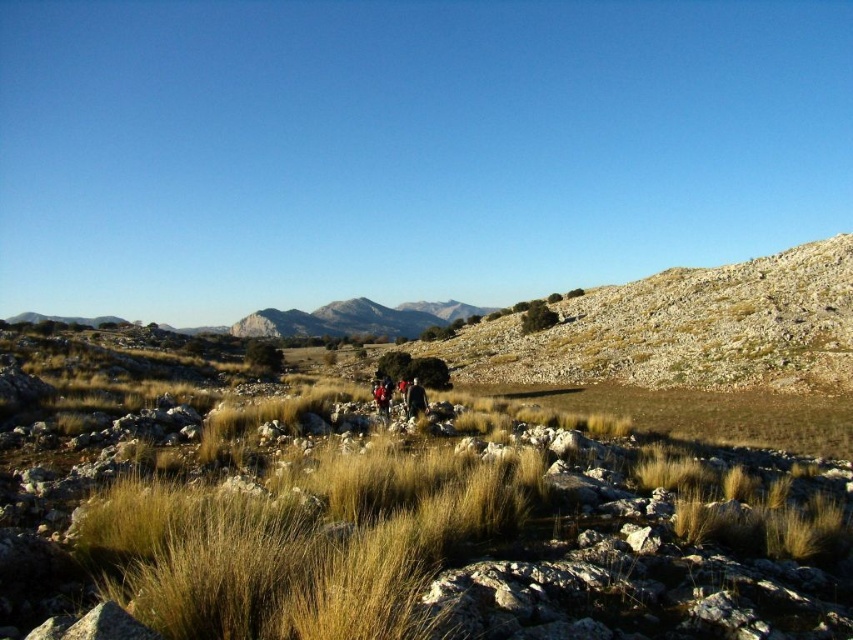
Question: Does dark brown leather jacket at center come in front of red fabric person at center?

Choices:
 (A) yes
 (B) no

Answer: (A)

Question: Which object appears farthest from the camera in this image?

Choices:
 (A) dry grass at center
 (B) rugged brown mountain at center

Answer: (B)

Question: Can you confirm if dry grass at center is positioned to the left of dark brown leather jacket at center?

Choices:
 (A) yes
 (B) no

Answer: (B)

Question: Can you confirm if dark brown leather jacket at center is bigger than red fabric person at center?

Choices:
 (A) no
 (B) yes

Answer: (B)

Question: Among these objects, which one is nearest to the camera?

Choices:
 (A) rugged brown mountain at center
 (B) dark brown leather jacket at center

Answer: (B)

Question: Which object is closer to the camera taking this photo?

Choices:
 (A) red fabric person at center
 (B) rugged brown mountain at center
 (C) dry grass at center
 (D) dark brown leather jacket at center

Answer: (C)